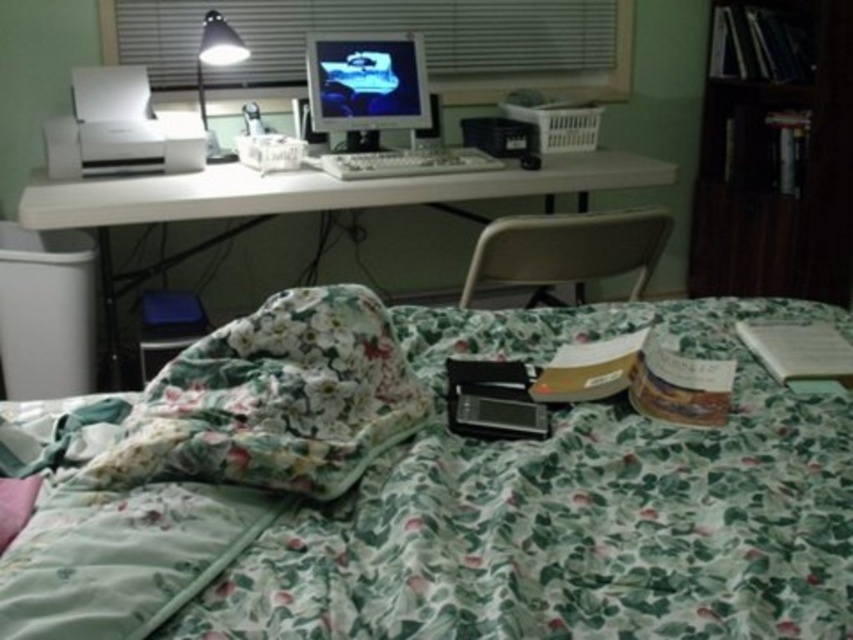
Question: From the image, what is the correct spatial relationship of floral fabric bed at center in relation to white plastic blinds at upper center?

Choices:
 (A) left
 (B) right

Answer: (B)

Question: Which is nearer to the matte plastic computer monitor at center?

Choices:
 (A) white plastic blinds at upper center
 (B) white matte printer at upper left

Answer: (A)

Question: In this image, where is white matte printer at upper left located relative to matte white desk lamp at upper left?

Choices:
 (A) above
 (B) below

Answer: (B)

Question: Which of these objects is positioned farthest from the white plastic computer desk at upper center?

Choices:
 (A) matte plastic computer monitor at center
 (B) white plastic blinds at upper center

Answer: (B)

Question: Among these objects, which one is nearest to the camera?

Choices:
 (A) white matte printer at upper left
 (B) matte plastic monitor at center
 (C) floral fabric bed at center
 (D) matte plastic computer monitor at center

Answer: (C)

Question: Is white plastic blinds at upper center to the left of matte white desk lamp at upper left from the viewer's perspective?

Choices:
 (A) yes
 (B) no

Answer: (B)